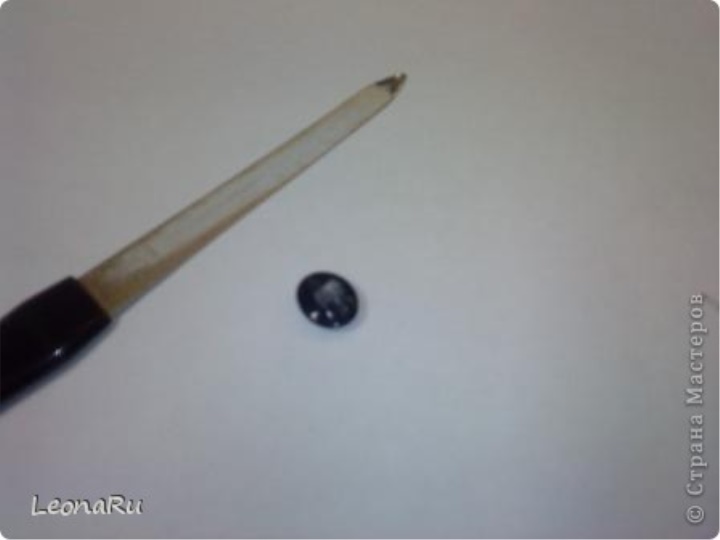
At what (x,y) coordinates should I click in order to perform the action: click on handle. Please return your answer as a coordinate pair (x, y). The height and width of the screenshot is (540, 720). Looking at the image, I should click on (37, 337).